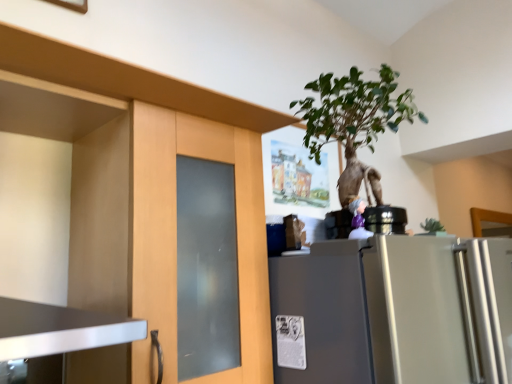
What is the approximate height of green leafy plant at upper center?

The height of green leafy plant at upper center is 16.20 inches.

Locate an element on the screen. matte wood cabinet at left is located at coordinates (175, 120).

Is satin silver refrigerator at right not near matte wood cabinet at left?

satin silver refrigerator at right is near matte wood cabinet at left, not far away.

Which object is closer to the camera taking this photo, satin silver refrigerator at right or matte wood cabinet at left?

matte wood cabinet at left is in front.

Identify the location of refrigerator that appears on the right of matte wood cabinet at left. Image resolution: width=512 pixels, height=384 pixels. (394, 311).

From the image's perspective, which one is positioned lower, satin silver refrigerator at right or matte wood cabinet at left?

satin silver refrigerator at right.

From a real-world perspective, who is located higher, matte wood cabinet at left or satin silver refrigerator at right?

In real-world perspective, matte wood cabinet at left is above.

Does matte wood cabinet at left turn towards satin silver refrigerator at right?

No, matte wood cabinet at left is not aimed at satin silver refrigerator at right.

Who is more distant, matte wood cabinet at left or satin silver refrigerator at right?

satin silver refrigerator at right is behind.

Can you confirm if matte wood cabinet at left is thinner than satin silver refrigerator at right?

Indeed, matte wood cabinet at left has a lesser width compared to satin silver refrigerator at right.

Considering the positions of objects green leafy plant at upper center and matte wood cabinet at left in the image provided, who is more to the left, green leafy plant at upper center or matte wood cabinet at left?

Positioned to the left is matte wood cabinet at left.

Are green leafy plant at upper center and matte wood cabinet at left making contact?

green leafy plant at upper center is not next to matte wood cabinet at left, and they're not touching.

From a real-world perspective, is green leafy plant at upper center positioned under matte wood cabinet at left based on gravity?

Incorrect, from a real-world perspective, green leafy plant at upper center is higher than matte wood cabinet at left.

Would you say matte wood cabinet at left is part of green leafy plant at upper center's contents?

No, matte wood cabinet at left is not a part of green leafy plant at upper center.

Could you tell me if matte wood cabinet at left is turned towards green leafy plant at upper center?

No.

From a real-world perspective, who is located lower, matte wood cabinet at left or green leafy plant at upper center?

In real-world perspective, matte wood cabinet at left is lower.

From the image's perspective, is matte wood cabinet at left on top of green leafy plant at upper center?

No, from the image's perspective, matte wood cabinet at left is not on top of green leafy plant at upper center.

This screenshot has width=512, height=384. Identify the location of cabinetry that appears below the green leafy plant at upper center (from a real-world perspective). (175, 120).

Can you confirm if satin silver refrigerator at right is taller than green leafy plant at upper center?

Indeed, satin silver refrigerator at right has a greater height compared to green leafy plant at upper center.

From the picture: Which of these two, satin silver refrigerator at right or green leafy plant at upper center, is bigger?

satin silver refrigerator at right.

From a real-world perspective, between satin silver refrigerator at right and green leafy plant at upper center, who is vertically higher?

In real-world perspective, green leafy plant at upper center is above.

Is point (354, 72) positioned behind point (484, 316)?

That is True.

Is satin silver refrigerator at right inside green leafy plant at upper center?

No.

From the image's perspective, is green leafy plant at upper center above or below satin silver refrigerator at right?

Clearly, from the image's perspective, green leafy plant at upper center is above satin silver refrigerator at right.

This screenshot has height=384, width=512. What are the coordinates of `refrigerator below the matte wood cabinet at left (from the image's perspective)` in the screenshot? It's located at (394, 311).

Identify the location of cabinetry located above the satin silver refrigerator at right (from the image's perspective). This screenshot has height=384, width=512. (175, 120).

From the image, which object appears to be nearer to satin silver refrigerator at right, matte wood cabinet at left or green leafy plant at upper center?

The object closer to satin silver refrigerator at right is matte wood cabinet at left.

Based on their spatial positions, is matte wood cabinet at left or satin silver refrigerator at right further from green leafy plant at upper center?

The object further to green leafy plant at upper center is satin silver refrigerator at right.

Looking at the image, which one is located closer to matte wood cabinet at left, green leafy plant at upper center or satin silver refrigerator at right?

satin silver refrigerator at right lies closer to matte wood cabinet at left than the other object.

Considering their positions, is satin silver refrigerator at right positioned closer to matte wood cabinet at left than green leafy plant at upper center?

Based on the image, satin silver refrigerator at right appears to be nearer to matte wood cabinet at left.

Estimate the real-world distances between objects in this image. Which object is closer to satin silver refrigerator at right, green leafy plant at upper center or matte wood cabinet at left?

matte wood cabinet at left is positioned closer to the anchor satin silver refrigerator at right.

Looking at this image, estimate the real-world distances between objects in this image. Which object is further from green leafy plant at upper center, satin silver refrigerator at right or matte wood cabinet at left?

satin silver refrigerator at right is further to green leafy plant at upper center.

Identify the location of houseplant situated between matte wood cabinet at left and satin silver refrigerator at right from left to right. The image size is (512, 384). (354, 122).